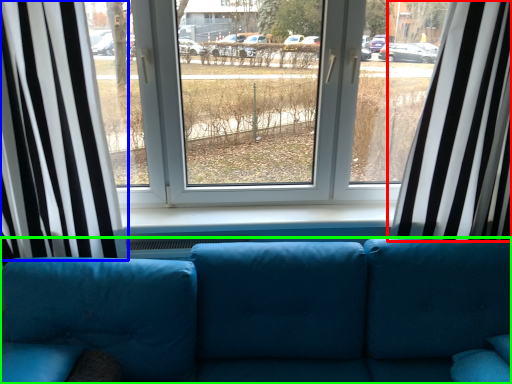
Question: Based on their relative distances, which object is farther from curtain (highlighted by a red box)? Choose from curtain (highlighted by a blue box) and studio couch (highlighted by a green box).

Choices:
 (A) curtain
 (B) studio couch

Answer: (A)